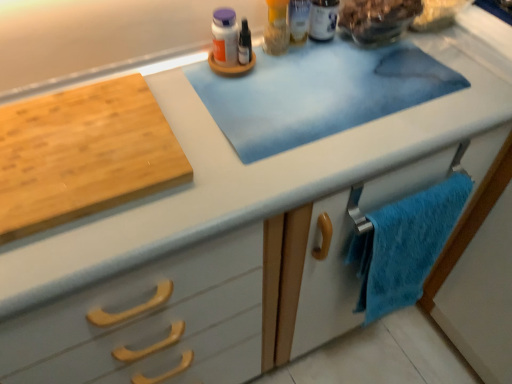
Where is `free location in front of white plastic bottle at upper center, which appears as the 2th toiletry when viewed from the left`? This screenshot has height=384, width=512. free location in front of white plastic bottle at upper center, which appears as the 2th toiletry when viewed from the left is located at coordinates (335, 82).